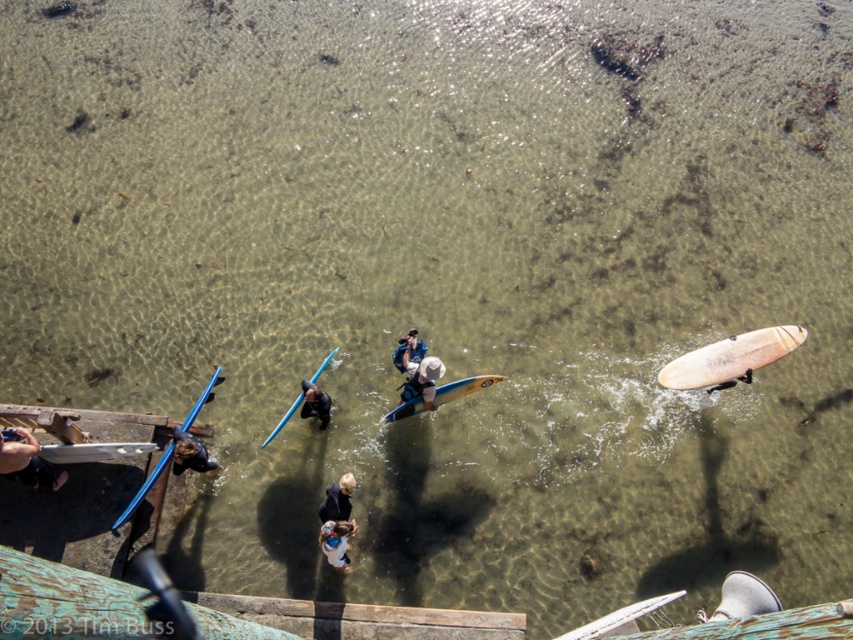
Question: Is white cotton shirt at center below blue glossy surfboard at center?

Choices:
 (A) yes
 (B) no

Answer: (A)

Question: Where is white glossy surfboard at lower right located in relation to matte white surfboard at center in the image?

Choices:
 (A) left
 (B) right

Answer: (B)

Question: Among these objects, which one is farthest from the camera?

Choices:
 (A) white cotton shirt at center
 (B) dark blue fabric at center
 (C) blue glossy surfboard at center
 (D) smooth blue surfboard at lower left

Answer: (C)

Question: Estimate the real-world distances between objects in this image. Which object is closer to the light blue smooth surfboard at center?

Choices:
 (A) dark blue fabric at center
 (B) white cotton shirt at center

Answer: (A)

Question: Does matte black surfboard at lower left come behind matte white surfboard at center?

Choices:
 (A) no
 (B) yes

Answer: (A)

Question: Which of the following is the farthest from the observer?

Choices:
 (A) (399, 356)
 (B) (20, 472)
 (C) (71, 444)
 (D) (334, 560)

Answer: (A)